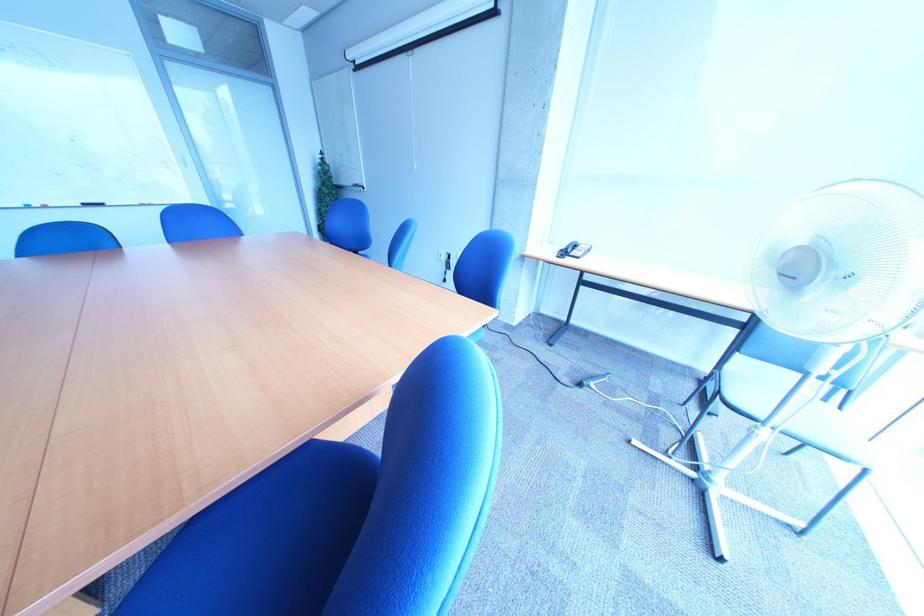
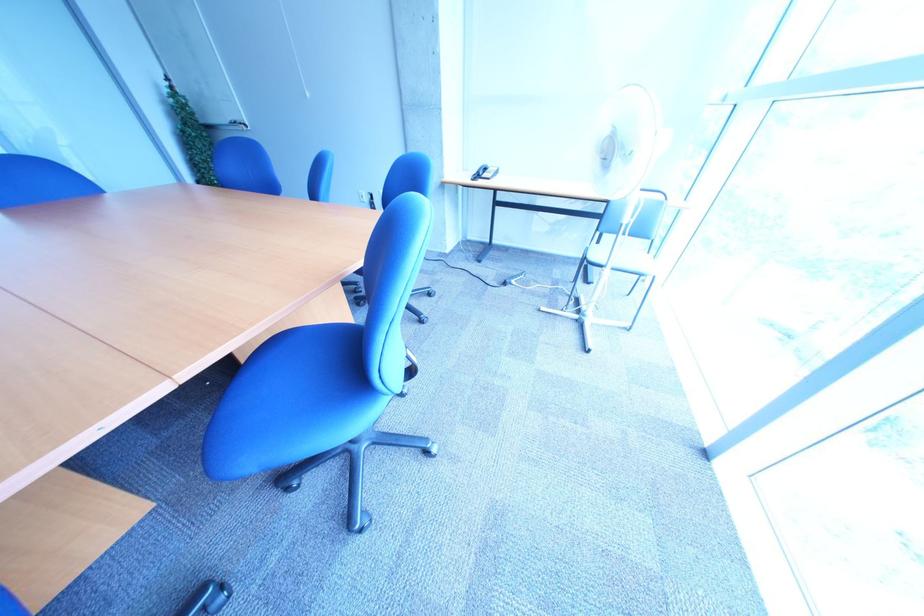
Where in the second image is the point corresponding to pixel 580 251 from the first image?

(492, 174)